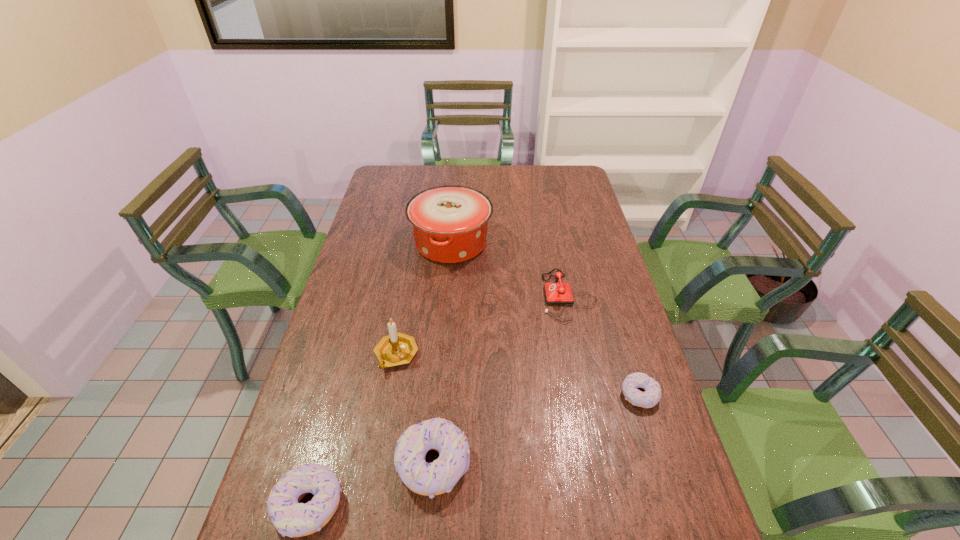
Find the location of a particular element. vacant area located on the dial of the telephone is located at coordinates (419, 295).

Find the location of a particular element. vacant space located 0.150m on the dial of the telephone is located at coordinates (495, 295).

I want to click on free location located on the dial of the telephone, so click(x=419, y=295).

Find the location of a particular element. free space located on the back of the fifth shortest object is located at coordinates click(x=407, y=296).

Where is `object located at the near edge`? Image resolution: width=960 pixels, height=540 pixels. object located at the near edge is located at coordinates (429, 479).

You are a GUI agent. You are given a task and a screenshot of the screen. Output one action in this format:
    pyautogui.click(x=<x>, y=<y>)
    Task: Click on the object that is at the left edge
    The image size is (960, 540).
    Given the screenshot: What is the action you would take?
    pyautogui.click(x=395, y=349)

The height and width of the screenshot is (540, 960). Identify the location of doughnut located at the right edge. (648, 399).

I want to click on telephone located at the right edge, so click(x=558, y=293).

The width and height of the screenshot is (960, 540). Identify the location of free space at the far edge of the desktop. (420, 177).

The width and height of the screenshot is (960, 540). In the image, there is a desktop. Identify the location of vacant area at the near edge. (379, 505).